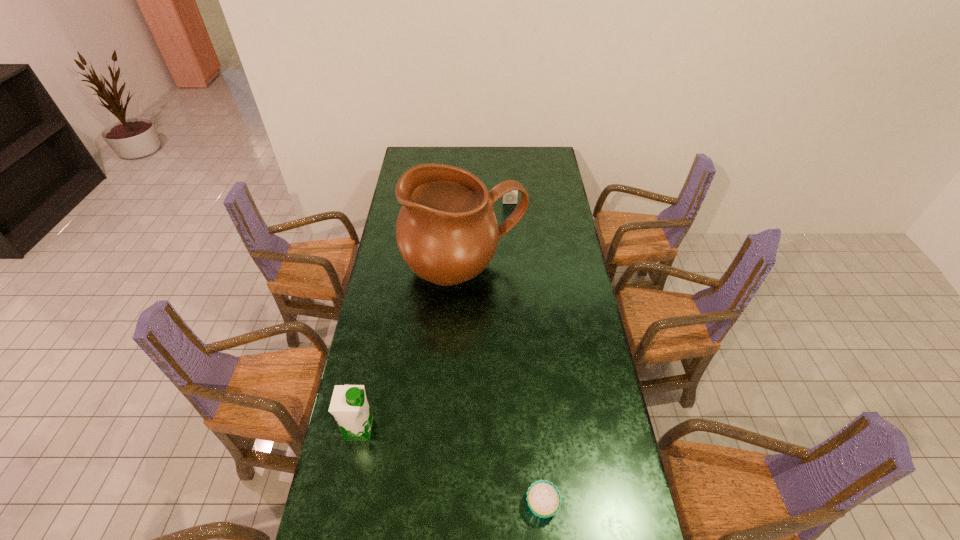
The image size is (960, 540). Identify the location of vacant space that satisfies the following two spatial constraints: 1. on the front-facing side of the second tallest object; 2. on the back side of the nearest object. (345, 504).

This screenshot has height=540, width=960. In order to click on free space that satisfies the following two spatial constraints: 1. at the spout of the second farthest object; 2. on the front-facing side of the soya milk in this screenshot , I will do `click(458, 429)`.

You are a GUI agent. You are given a task and a screenshot of the screen. Output one action in this format:
    pyautogui.click(x=<x>, y=<y>)
    Task: Click on the free space that satisfies the following two spatial constraints: 1. at the spout of the tallest object; 2. on the front-facing side of the second nearest object
    The width and height of the screenshot is (960, 540).
    Given the screenshot: What is the action you would take?
    pyautogui.click(x=458, y=429)

At what (x,y) coordinates should I click in order to perform the action: click on free point that satisfies the following two spatial constraints: 1. on the front-facing side of the iPod; 2. on the front-facing side of the third shortest object. Please return your answer as a coordinate pair (x, y). This screenshot has height=540, width=960. Looking at the image, I should click on (527, 429).

I want to click on vacant area that satisfies the following two spatial constraints: 1. at the spout of the second farthest object; 2. on the right side of the shortest object, so click(455, 504).

Find the location of a particular element. The width and height of the screenshot is (960, 540). free location that satisfies the following two spatial constraints: 1. on the back side of the cupcake; 2. on the front-facing side of the third farthest object is located at coordinates (536, 429).

This screenshot has height=540, width=960. Find the location of `vacant space that satisfies the following two spatial constraints: 1. on the front-facing side of the cupcake; 2. on the left side of the iPod`. vacant space that satisfies the following two spatial constraints: 1. on the front-facing side of the cupcake; 2. on the left side of the iPod is located at coordinates (533, 504).